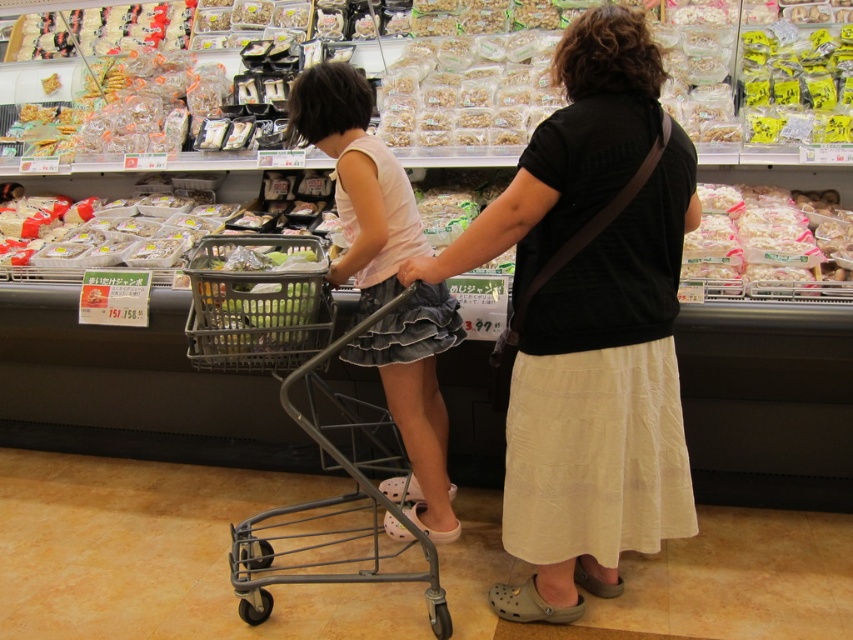
Question: Based on their relative distances, which object is nearer to the black cotton shirt at center?

Choices:
 (A) clear plastic containers at center
 (B) metallic gray shopping cart at center

Answer: (B)

Question: Which of the following is the closest to the observer?

Choices:
 (A) clear plastic containers at center
 (B) yellow plastic bag at upper right
 (C) green plastic basket at center
 (D) metallic gray shopping cart at center

Answer: (D)

Question: Does black cotton shirt at center come in front of metallic gray shopping cart at center?

Choices:
 (A) yes
 (B) no

Answer: (A)

Question: Which point appears farthest from the camera in this image?

Choices:
 (A) (490, 244)
 (B) (753, 132)
 (C) (289, 355)
 (D) (721, 273)

Answer: (B)

Question: Considering the relative positions of matte black shirt at center and green plastic basket at center in the image provided, where is matte black shirt at center located with respect to green plastic basket at center?

Choices:
 (A) left
 (B) right

Answer: (B)

Question: Observing the image, what is the correct spatial positioning of matte black shirt at center in reference to green plastic basket at center?

Choices:
 (A) below
 (B) above

Answer: (A)